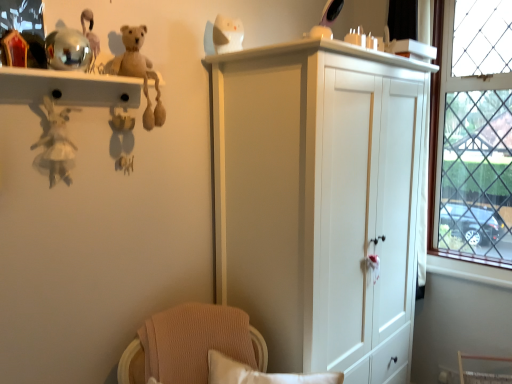
Measure the distance between point (482, 28) and camera.

They are 2.18 meters apart.

Image resolution: width=512 pixels, height=384 pixels. What do you see at coordinates (68, 88) in the screenshot?
I see `metallic reflective shelf at upper left` at bounding box center [68, 88].

This screenshot has width=512, height=384. Find the location of `beige plush bear at upper left, which ranks as the 3th toy in right-to-left order`. beige plush bear at upper left, which ranks as the 3th toy in right-to-left order is located at coordinates (138, 72).

Where is `white fabric doll at left, the 5th toy viewed from the right`? The height and width of the screenshot is (384, 512). white fabric doll at left, the 5th toy viewed from the right is located at coordinates point(57,143).

I want to click on clear glass window at right, so click(472, 133).

What's the angular difference between white fabric doll at left, the first toy in the left-to-right sequence, and beige plush bear at upper left, which is the 3th toy in left-to-right order,'s facing directions?

The angular difference between white fabric doll at left, the first toy in the left-to-right sequence, and beige plush bear at upper left, which is the 3th toy in left-to-right order, is 0.0029 degrees.

Would you say beige plush bear at upper left, which ranks as the 3th toy in right-to-left order, is part of white fabric doll at left, the first toy in the left-to-right sequence,'s contents?

No, beige plush bear at upper left, which ranks as the 3th toy in right-to-left order, is located outside of white fabric doll at left, the first toy in the left-to-right sequence.

From a real-world perspective, count 2nd toys upward from the white fabric doll at left, the 5th toy viewed from the right, and point to it. Please provide its 2D coordinates.

[(138, 72)]

From a real-world perspective, is white fabric doll at left, the first toy in the left-to-right sequence, below beige plush bear at upper left, which ranks as the 3th toy in right-to-left order?

Yes, from a real-world perspective, white fabric doll at left, the first toy in the left-to-right sequence, is under beige plush bear at upper left, which ranks as the 3th toy in right-to-left order.

Would you say white fabric doll at left, the first toy in the left-to-right sequence, is a long distance from shiny plastic mirror at upper center, arranged as the 5th toy when viewed from the left?

Yes.

Is white fabric doll at left, the first toy in the left-to-right sequence, bigger than shiny plastic mirror at upper center, which is counted as the first toy, starting from the right?

Correct, white fabric doll at left, the first toy in the left-to-right sequence, is larger in size than shiny plastic mirror at upper center, which is counted as the first toy, starting from the right.

Considering the positions of points (56, 171) and (310, 37), is point (56, 171) closer to camera compared to point (310, 37)?

Yes, point (56, 171) is in front of point (310, 37).

From the picture: Which is correct: white fabric doll at left, the 5th toy viewed from the right, is inside shiny plastic mirror at upper center, which is counted as the first toy, starting from the right, or outside of it?

white fabric doll at left, the 5th toy viewed from the right, lies outside shiny plastic mirror at upper center, which is counted as the first toy, starting from the right.

Is there a large distance between shiny plastic mirror at upper center, arranged as the 5th toy when viewed from the left, and metallic gold toy at upper left, which appears as the 4th toy when viewed from the right?

shiny plastic mirror at upper center, arranged as the 5th toy when viewed from the left, is far away from metallic gold toy at upper left, which appears as the 4th toy when viewed from the right.

Is shiny plastic mirror at upper center, which is counted as the first toy, starting from the right, facing towards metallic gold toy at upper left, which appears as the 4th toy when viewed from the right?

No, shiny plastic mirror at upper center, which is counted as the first toy, starting from the right, does not turn towards metallic gold toy at upper left, which appears as the 4th toy when viewed from the right.

Considering the relative sizes of shiny plastic mirror at upper center, arranged as the 5th toy when viewed from the left, and metallic gold toy at upper left, the second toy when ordered from left to right, in the image provided, is shiny plastic mirror at upper center, arranged as the 5th toy when viewed from the left, taller than metallic gold toy at upper left, the second toy when ordered from left to right,?

Incorrect, the height of shiny plastic mirror at upper center, arranged as the 5th toy when viewed from the left, is not larger of that of metallic gold toy at upper left, the second toy when ordered from left to right.

Looking at this image, choose the correct answer: Is shiny plastic mirror at upper center, which is counted as the first toy, starting from the right, inside metallic gold toy at upper left, the second toy when ordered from left to right, or outside it?

shiny plastic mirror at upper center, which is counted as the first toy, starting from the right, is not enclosed by metallic gold toy at upper left, the second toy when ordered from left to right.

Considering the positions of objects metallic gold toy at upper left, which appears as the 4th toy when viewed from the right, and shiny plastic mirror at upper center, which is counted as the first toy, starting from the right, in the image provided, who is more to the left, metallic gold toy at upper left, which appears as the 4th toy when viewed from the right, or shiny plastic mirror at upper center, which is counted as the first toy, starting from the right,?

metallic gold toy at upper left, which appears as the 4th toy when viewed from the right, is more to the left.

Which is nearer, (132, 137) or (327, 21)?

Positioned in front is point (132, 137).

From the shiny plastic mirror at upper center, which is counted as the first toy, starting from the right, count 1st toys backward and point to it. Please provide its 2D coordinates.

[(121, 123)]

Is metallic gold toy at upper left, the second toy when ordered from left to right, positioned beyond the bounds of shiny plastic mirror at upper center, which is counted as the first toy, starting from the right?

Absolutely, metallic gold toy at upper left, the second toy when ordered from left to right, is external to shiny plastic mirror at upper center, which is counted as the first toy, starting from the right.

From the image's perspective, is metallic gold toy at upper left, which appears as the 4th toy when viewed from the right, on top of white glossy cat at upper center, acting as the second toy starting from the right?

Incorrect, from the image's perspective, metallic gold toy at upper left, which appears as the 4th toy when viewed from the right, is lower than white glossy cat at upper center, acting as the second toy starting from the right.

Consider the image. Would you say metallic gold toy at upper left, which appears as the 4th toy when viewed from the right, is a long distance from white glossy cat at upper center, which ranks as the fourth toy in left-to-right order?

metallic gold toy at upper left, which appears as the 4th toy when viewed from the right, is actually quite close to white glossy cat at upper center, which ranks as the fourth toy in left-to-right order.

Consider the image. Considering the positions of objects metallic gold toy at upper left, the second toy when ordered from left to right, and white glossy cat at upper center, acting as the second toy starting from the right, in the image provided, who is in front, metallic gold toy at upper left, the second toy when ordered from left to right, or white glossy cat at upper center, acting as the second toy starting from the right,?

metallic gold toy at upper left, the second toy when ordered from left to right, is more forward.

From a real-world perspective, is metallic gold toy at upper left, which appears as the 4th toy when viewed from the right, positioned under white glossy cat at upper center, acting as the second toy starting from the right, based on gravity?

Yes.

Consider the image. Is shiny plastic mirror at upper center, arranged as the 5th toy when viewed from the left, facing away from beige plush bear at upper left, which is the 3th toy in left-to-right order?

No, shiny plastic mirror at upper center, arranged as the 5th toy when viewed from the left,'s orientation is not away from beige plush bear at upper left, which is the 3th toy in left-to-right order.

Consider the image. From a real-world perspective, is shiny plastic mirror at upper center, arranged as the 5th toy when viewed from the left, below beige plush bear at upper left, which is the 3th toy in left-to-right order?

No, from a real-world perspective, shiny plastic mirror at upper center, arranged as the 5th toy when viewed from the left, is not beneath beige plush bear at upper left, which is the 3th toy in left-to-right order.

Considering the relative positions of shiny plastic mirror at upper center, arranged as the 5th toy when viewed from the left, and beige plush bear at upper left, which is the 3th toy in left-to-right order, in the image provided, is shiny plastic mirror at upper center, arranged as the 5th toy when viewed from the left, to the left of beige plush bear at upper left, which is the 3th toy in left-to-right order, from the viewer's perspective?

In fact, shiny plastic mirror at upper center, arranged as the 5th toy when viewed from the left, is to the right of beige plush bear at upper left, which is the 3th toy in left-to-right order.

In the scene shown: Is shiny plastic mirror at upper center, arranged as the 5th toy when viewed from the left, positioned beyond the bounds of beige plush bear at upper left, which is the 3th toy in left-to-right order?

Absolutely, shiny plastic mirror at upper center, arranged as the 5th toy when viewed from the left, is external to beige plush bear at upper left, which is the 3th toy in left-to-right order.

Which object is wider, white glossy cat at upper center, which ranks as the fourth toy in left-to-right order, or white fabric doll at left, the 5th toy viewed from the right?

white glossy cat at upper center, which ranks as the fourth toy in left-to-right order, is wider.

Which is in front, white glossy cat at upper center, which ranks as the fourth toy in left-to-right order, or white fabric doll at left, the first toy in the left-to-right sequence?

white fabric doll at left, the first toy in the left-to-right sequence, is closer to the camera.

From the image's perspective, starting from the white fabric doll at left, the 5th toy viewed from the right, which toy is the 4th one above? Please provide its 2D coordinates.

[(227, 34)]

Is white glossy cat at upper center, acting as the second toy starting from the right, taller than white fabric doll at left, the 5th toy viewed from the right?

In fact, white glossy cat at upper center, acting as the second toy starting from the right, may be shorter than white fabric doll at left, the 5th toy viewed from the right.

Starting from the white fabric doll at left, the first toy in the left-to-right sequence, which toy is the 1st one behind? Please provide its 2D coordinates.

[(138, 72)]

Find the location of a particular element. the 4th toy to the left of the shiny plastic mirror at upper center, which is counted as the first toy, starting from the right, counting from the anchor's position is located at coordinates (57, 143).

Estimate the real-world distances between objects in this image. Which object is further from metallic gold toy at upper left, the second toy when ordered from left to right, beige plush bear at upper left, which is the 3th toy in left-to-right order, or white glossy cat at upper center, which ranks as the fourth toy in left-to-right order?

Among the two, white glossy cat at upper center, which ranks as the fourth toy in left-to-right order, is located further to metallic gold toy at upper left, the second toy when ordered from left to right.

Estimate the real-world distances between objects in this image. Which object is further from metallic reflective shelf at upper left, white fabric doll at left, the first toy in the left-to-right sequence, or white glossy cat at upper center, which ranks as the fourth toy in left-to-right order?

white glossy cat at upper center, which ranks as the fourth toy in left-to-right order, is positioned further to the anchor metallic reflective shelf at upper left.

Based on their spatial positions, is beige plush bear at upper left, which ranks as the 3th toy in right-to-left order, or metallic gold toy at upper left, the second toy when ordered from left to right, closer to metallic reflective shelf at upper left?

beige plush bear at upper left, which ranks as the 3th toy in right-to-left order, lies closer to metallic reflective shelf at upper left than the other object.

In the scene shown: Based on their spatial positions, is white fabric doll at left, the 5th toy viewed from the right, or white glossy cat at upper center, acting as the second toy starting from the right, closer to shiny plastic mirror at upper center, arranged as the 5th toy when viewed from the left?

Among the two, white glossy cat at upper center, acting as the second toy starting from the right, is located nearer to shiny plastic mirror at upper center, arranged as the 5th toy when viewed from the left.

Based on their spatial positions, is white glossy cat at upper center, acting as the second toy starting from the right, or shiny plastic mirror at upper center, arranged as the 5th toy when viewed from the left, further from beige plush bear at upper left, which ranks as the 3th toy in right-to-left order?

The object further to beige plush bear at upper left, which ranks as the 3th toy in right-to-left order, is shiny plastic mirror at upper center, arranged as the 5th toy when viewed from the left.

Considering their positions, is clear glass window at right positioned closer to white glossy cat at upper center, acting as the second toy starting from the right, than metallic reflective shelf at upper left?

metallic reflective shelf at upper left is closer to white glossy cat at upper center, acting as the second toy starting from the right.

Estimate the real-world distances between objects in this image. Which object is closer to beige plush bear at upper left, which ranks as the 3th toy in right-to-left order, clear glass window at right or white fabric doll at left, the first toy in the left-to-right sequence?

Based on the image, white fabric doll at left, the first toy in the left-to-right sequence, appears to be nearer to beige plush bear at upper left, which ranks as the 3th toy in right-to-left order.

From the image, which object appears to be nearer to metallic gold toy at upper left, the second toy when ordered from left to right, white glossy cat at upper center, which ranks as the fourth toy in left-to-right order, or beige plush bear at upper left, which ranks as the 3th toy in right-to-left order?

The object closer to metallic gold toy at upper left, the second toy when ordered from left to right, is beige plush bear at upper left, which ranks as the 3th toy in right-to-left order.

I want to click on toy situated between white glossy cat at upper center, acting as the second toy starting from the right, and clear glass window at right from left to right, so click(x=327, y=19).

This screenshot has height=384, width=512. I want to click on shelf located between white fabric doll at left, the first toy in the left-to-right sequence, and clear glass window at right in the left-right direction, so click(x=68, y=88).

Find the location of a particular element. Image resolution: width=512 pixels, height=384 pixels. shelf located between white fabric doll at left, the first toy in the left-to-right sequence, and shiny plastic mirror at upper center, arranged as the 5th toy when viewed from the left, in the left-right direction is located at coordinates (68, 88).

Image resolution: width=512 pixels, height=384 pixels. In order to click on toy situated between beige plush bear at upper left, which is the 3th toy in left-to-right order, and shiny plastic mirror at upper center, arranged as the 5th toy when viewed from the left, from left to right in this screenshot , I will do `click(227, 34)`.